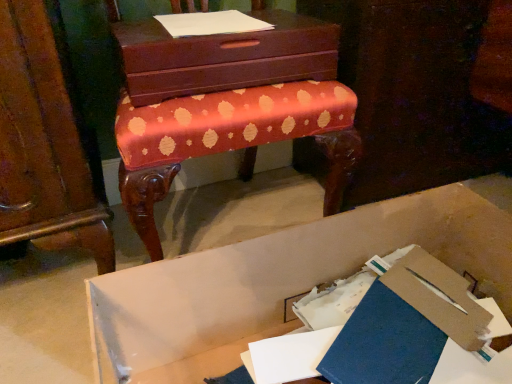
Consider the image. Measure the distance between matte brown chest of drawers at upper center and camera.

matte brown chest of drawers at upper center and camera are 31.49 inches apart.

Locate an element on the screen. The image size is (512, 384). blue matte paper at lower center is located at coordinates [x=406, y=325].

Image resolution: width=512 pixels, height=384 pixels. Identify the location of notebook behind the matte brown chest of drawers at upper center. (211, 23).

Which of these two, white paper at upper center or matte brown chest of drawers at upper center, is thinner?

white paper at upper center is thinner.

Is white paper at upper center to the right of matte brown chest of drawers at upper center from the viewer's perspective?

No, white paper at upper center is not to the right of matte brown chest of drawers at upper center.

Considering the sizes of objects blue matte paper at lower center and white cardboard box at lower center in the image provided, who is shorter, blue matte paper at lower center or white cardboard box at lower center?

Standing shorter between the two is blue matte paper at lower center.

Does blue matte paper at lower center lie in front of white cardboard box at lower center?

That is False.

From the image's perspective, does blue matte paper at lower center appear lower than white cardboard box at lower center?

No, from the image's perspective, blue matte paper at lower center is not below white cardboard box at lower center.

Looking at this image, how far apart are white paper at upper center and white cardboard box at lower center?

white paper at upper center and white cardboard box at lower center are 21.77 inches apart from each other.

Based on the photo, how different are the orientations of white paper at upper center and white cardboard box at lower center in degrees?

The angular difference between white paper at upper center and white cardboard box at lower center is 1.75 degrees.

You are a GUI agent. You are given a task and a screenshot of the screen. Output one action in this format:
    pyautogui.click(x=<x>, y=<y>)
    Task: Click on the notebook on the left of the white cardboard box at lower center
    This screenshot has height=384, width=512.
    Given the screenshot: What is the action you would take?
    pyautogui.click(x=211, y=23)

Is white paper at upper center aimed at white cardboard box at lower center?

No.

Is white cardboard box at lower center oriented towards matte brown chest of drawers at upper center?

No.

Would you say white cardboard box at lower center is a long distance from matte brown chest of drawers at upper center?

white cardboard box at lower center is near matte brown chest of drawers at upper center, not far away.

Considering the sizes of objects white cardboard box at lower center and matte brown chest of drawers at upper center in the image provided, who is shorter, white cardboard box at lower center or matte brown chest of drawers at upper center?

matte brown chest of drawers at upper center is shorter.

How different are the orientations of white cardboard box at lower center and matte brown chest of drawers at upper center in degrees?

white cardboard box at lower center and matte brown chest of drawers at upper center are facing 0.473 degrees away from each other.

From a real-world perspective, is white paper at upper center below blue matte paper at lower center?

No, from a real-world perspective, white paper at upper center is not beneath blue matte paper at lower center.

Considering the sizes of white paper at upper center and blue matte paper at lower center in the image, is white paper at upper center wider or thinner than blue matte paper at lower center?

Clearly, white paper at upper center has more width compared to blue matte paper at lower center.

Considering the relative sizes of white paper at upper center and blue matte paper at lower center in the image provided, is white paper at upper center bigger than blue matte paper at lower center?

No, white paper at upper center is not bigger than blue matte paper at lower center.

In the image, is white paper at upper center positioned in front of or behind blue matte paper at lower center?

Clearly, white paper at upper center is behind blue matte paper at lower center.

Considering the sizes of objects white cardboard box at lower center and blue matte paper at lower center in the image provided, who is shorter, white cardboard box at lower center or blue matte paper at lower center?

With less height is blue matte paper at lower center.

Does white cardboard box at lower center touch blue matte paper at lower center?

No, white cardboard box at lower center is not next to blue matte paper at lower center.

From the image's perspective, would you say white cardboard box at lower center is shown under blue matte paper at lower center?

Yes, from the image's perspective, white cardboard box at lower center is beneath blue matte paper at lower center.

In the scene shown: Is white cardboard box at lower center in front of or behind blue matte paper at lower center in the image?

Visually, white cardboard box at lower center is located in front of blue matte paper at lower center.

Which is closer to the camera, [424,250] or [240,17]?

The point [424,250] is closer.

Which of these two, blue matte paper at lower center or white paper at upper center, is thinner?

blue matte paper at lower center.

From the image's perspective, who appears lower, blue matte paper at lower center or white paper at upper center?

From the image's view, blue matte paper at lower center is below.

Would you say white paper at upper center is part of blue matte paper at lower center's contents?

That's incorrect, white paper at upper center is not inside blue matte paper at lower center.

You are a GUI agent. You are given a task and a screenshot of the screen. Output one action in this format:
    pyautogui.click(x=<x>, y=<y>)
    Task: Click on the notebook above the matte brown chest of drawers at upper center (from a real-world perspective)
    The image size is (512, 384).
    Given the screenshot: What is the action you would take?
    pyautogui.click(x=211, y=23)

The image size is (512, 384). In order to click on paperback book behind the white cardboard box at lower center in this screenshot , I will do coord(406,325).

From the image, which object appears to be farther from blue matte paper at lower center, white paper at upper center or matte brown chest of drawers at upper center?

white paper at upper center lies further to blue matte paper at lower center than the other object.

Considering their positions, is blue matte paper at lower center positioned closer to matte brown chest of drawers at upper center than white cardboard box at lower center?

white cardboard box at lower center lies closer to matte brown chest of drawers at upper center than the other object.

Looking at the image, which one is located closer to matte brown chest of drawers at upper center, white paper at upper center or white cardboard box at lower center?

Based on the image, white paper at upper center appears to be nearer to matte brown chest of drawers at upper center.

Based on their spatial positions, is white cardboard box at lower center or white paper at upper center further from matte brown chest of drawers at upper center?

white cardboard box at lower center lies further to matte brown chest of drawers at upper center than the other object.

Estimate the real-world distances between objects in this image. Which object is closer to white paper at upper center, matte brown chest of drawers at upper center or blue matte paper at lower center?

matte brown chest of drawers at upper center is closer to white paper at upper center.

Estimate the real-world distances between objects in this image. Which object is further from white paper at upper center, matte brown chest of drawers at upper center or white cardboard box at lower center?

white cardboard box at lower center is positioned further to the anchor white paper at upper center.

Based on their spatial positions, is white cardboard box at lower center or matte brown chest of drawers at upper center further from blue matte paper at lower center?

The object further to blue matte paper at lower center is matte brown chest of drawers at upper center.

Looking at the image, which one is located further to matte brown chest of drawers at upper center, blue matte paper at lower center or white paper at upper center?

blue matte paper at lower center is further to matte brown chest of drawers at upper center.

At what (x,y) coordinates should I click in order to perform the action: click on the chest of drawers between white paper at upper center and blue matte paper at lower center vertically. Please return your answer as a coordinate pair (x, y). This screenshot has height=384, width=512. Looking at the image, I should click on (225, 57).

What are the coordinates of `chest of drawers between white paper at upper center and white cardboard box at lower center in the up-down direction` in the screenshot? It's located at (225, 57).

Identify the location of paperback book that lies between white paper at upper center and white cardboard box at lower center from top to bottom. The image size is (512, 384). pos(406,325).

What are the coordinates of `paperback book between matte brown chest of drawers at upper center and white cardboard box at lower center in the up-down direction` in the screenshot? It's located at 406,325.